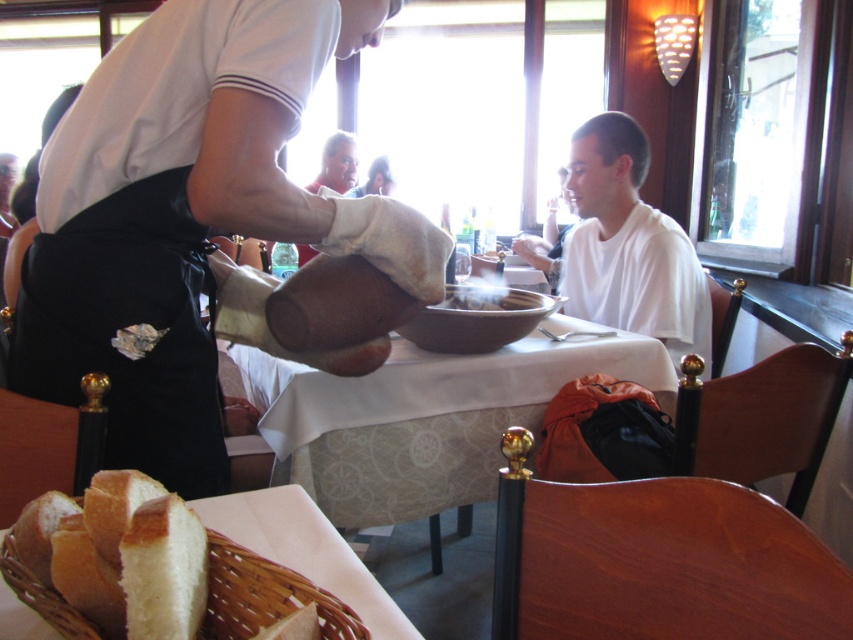
You are a customer sitting at the table in the midground. You notice a point at coordinates [158,289]. What object is located at that point?

The point at coordinates [158,289] corresponds to the white matte shirt at upper center.

You are a customer sitting at the table and want to grab the white wicker basket at lower left. Which direction should you move to reach it from the white matte shirt at center?

You should move to the left because the white matte shirt at center is to the right of the white wicker basket at lower left, so moving left from the shirt will lead you towards the basket.

You are a customer in this restaurant and want to know which of the two white matte shirts is wider. The shirts are labeled as the white matte shirt at upper center and the white matte shirt at center. Can you tell me which one is wider?

The white matte shirt at upper center is wider than the white matte shirt at center.